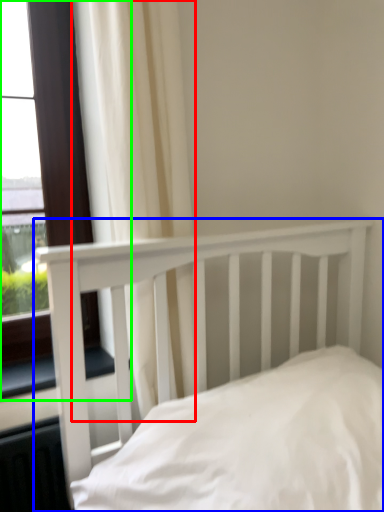
Question: Which object is positioned farthest from curtain (highlighted by a red box)? Select from bed (highlighted by a blue box) and window (highlighted by a green box).

Choices:
 (A) bed
 (B) window

Answer: (B)